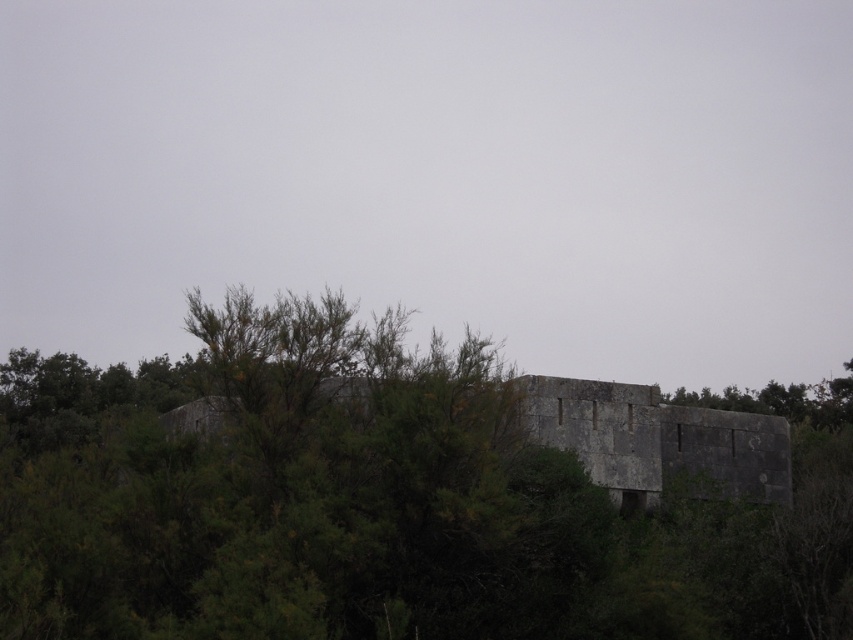
Between point (398, 346) and point (637, 499), which one is positioned behind?

Positioned behind is point (637, 499).

Does green leafy tree at center have a smaller size compared to gray stone fort at center?

Incorrect, green leafy tree at center is not smaller in size than gray stone fort at center.

Is point (469, 636) more distant than point (659, 444)?

That is False.

You are a GUI agent. You are given a task and a screenshot of the screen. Output one action in this format:
    pyautogui.click(x=<x>, y=<y>)
    Task: Click on the green leafy tree at center
    
    Given the screenshot: What is the action you would take?
    pyautogui.click(x=396, y=497)